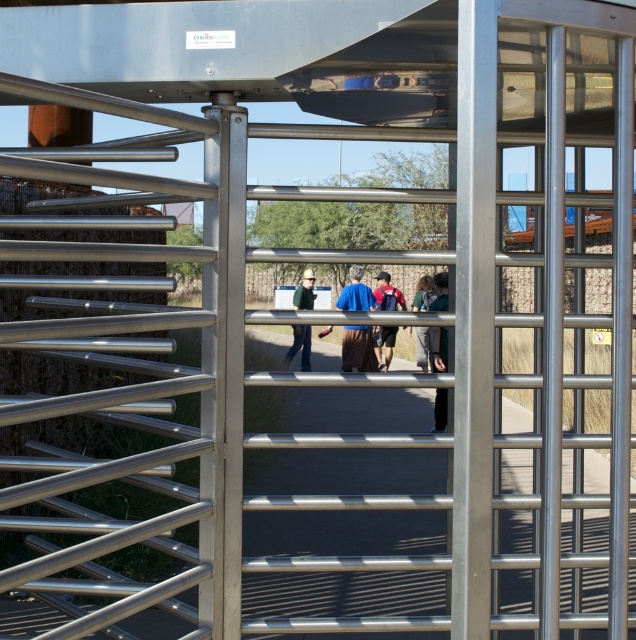
Question: Is transparent glass door at center wider than dark gray fabric jacket at center?

Choices:
 (A) yes
 (B) no

Answer: (A)

Question: Considering the real-world distances, which object is farthest from the green fabric jacket at center?

Choices:
 (A) dark gray pants at center
 (B) dark gray fabric jacket at center

Answer: (A)

Question: Is metallic gray path at center to the right of green fabric jacket at center from the viewer's perspective?

Choices:
 (A) no
 (B) yes

Answer: (B)

Question: Which is farther from the metallic gray path at center?

Choices:
 (A) dark gray pants at center
 (B) dark gray fabric jacket at center
 (C) green fabric jacket at center
 (D) transparent glass door at center

Answer: (C)

Question: Which object appears closest to the camera in this image?

Choices:
 (A) matte blue backpack at center
 (B) brown fabric at center
 (C) dark gray fabric jacket at center

Answer: (B)

Question: Is metallic gray path at center further to the viewer compared to brown fabric at center?

Choices:
 (A) yes
 (B) no

Answer: (B)